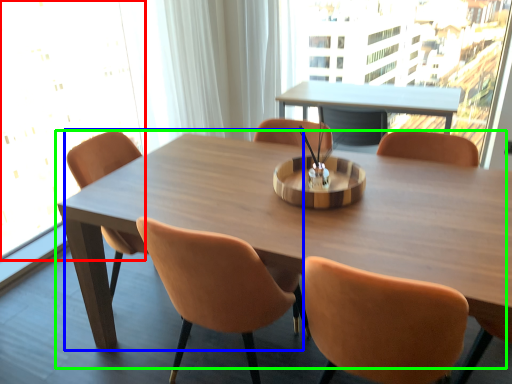
Question: Estimate the real-world distances between objects in this image. Which object is farther from window screen (highlighted by a red box), chair (highlighted by a blue box) or table (highlighted by a green box)?

Choices:
 (A) chair
 (B) table

Answer: (B)